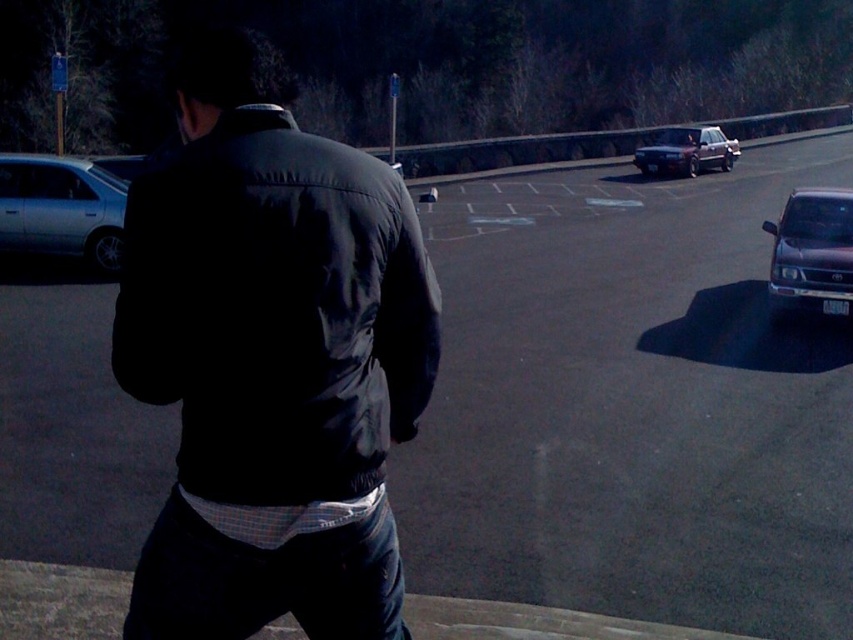
You are a delivery driver who needs to park your vehicle in this parking lot. You have two options available here. Which vehicle, the shiny dark gray suv at right or the matte black sedan at upper right, is closer to you where you can easily pull into the spot next to it?

The shiny dark gray suv at right is closer to you than the matte black sedan at upper right, so you can easily pull into the spot next to it.

You are standing at the point marked as point (816, 272) in the image. You want to walk towards the silver car on the left. Is the silver car on the left closer to you than 12 meters?

The distance of point (816, 272) from viewer is 10.75 meters. The silver car on the left is further away than the point, so it is more than 10.75 meters away. However, the question asks if it is closer than 12 meters. Since 10.75 meters is less than 12 meters, the silver car on the left is within 12 meters distance from the point.

Consider the image. You are a delivery person who needs to park your vehicle between the silver metallic sedan at left and the shiny dark gray suv at right. Your delivery van is 6 meters long. Is there enough space between them to park your van?

The distance between the silver metallic sedan at left and the shiny dark gray suv at right is 11.50 meters. Since your van is 6 meters long, there is sufficient space to park between them as 11.50 meters is greater than 6 meters.